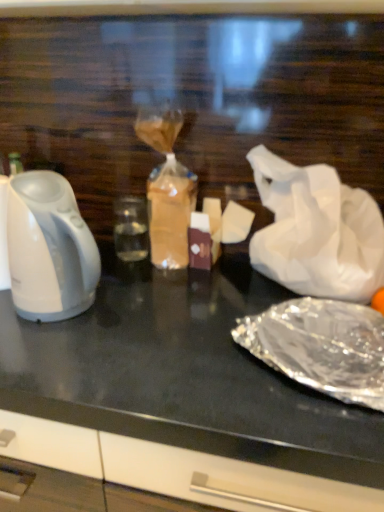
Question: Is white glossy kettle at left wider than shiny metallic foil at lower right?

Choices:
 (A) yes
 (B) no

Answer: (B)

Question: Is white glossy kettle at left taller than shiny metallic foil at lower right?

Choices:
 (A) no
 (B) yes

Answer: (B)

Question: Is white glossy kettle at left looking in the opposite direction of shiny metallic foil at lower right?

Choices:
 (A) no
 (B) yes

Answer: (A)

Question: Considering the relative sizes of white glossy kettle at left and shiny metallic foil at lower right in the image provided, is white glossy kettle at left shorter than shiny metallic foil at lower right?

Choices:
 (A) no
 (B) yes

Answer: (A)

Question: Is white glossy kettle at left not within shiny metallic foil at lower right?

Choices:
 (A) no
 (B) yes

Answer: (B)

Question: Considering the positions of black glossy table at center and white crumpled paper at right in the image, is black glossy table at center bigger or smaller than white crumpled paper at right?

Choices:
 (A) big
 (B) small

Answer: (A)

Question: Is point (230, 397) positioned closer to the camera than point (377, 208)?

Choices:
 (A) closer
 (B) farther

Answer: (A)

Question: Relative to white crumpled paper at right, is black glossy table at center in front or behind?

Choices:
 (A) front
 (B) behind

Answer: (A)

Question: From the image's perspective, relative to white crumpled paper at right, is black glossy table at center above or below?

Choices:
 (A) below
 (B) above

Answer: (A)

Question: From a real-world perspective, is shiny metallic foil at lower right physically located above or below white glossy kettle at left?

Choices:
 (A) above
 (B) below

Answer: (B)

Question: In the image, is shiny metallic foil at lower right on the left side or the right side of white glossy kettle at left?

Choices:
 (A) left
 (B) right

Answer: (B)

Question: Would you say shiny metallic foil at lower right is inside or outside white glossy kettle at left?

Choices:
 (A) outside
 (B) inside

Answer: (A)

Question: Considering the positions of point (309, 323) and point (77, 257), is point (309, 323) closer or farther from the camera than point (77, 257)?

Choices:
 (A) closer
 (B) farther

Answer: (B)

Question: Based on their positions, is black glossy table at center located to the left or right of white glossy kettle at left?

Choices:
 (A) right
 (B) left

Answer: (A)

Question: Would you say black glossy table at center is inside or outside white glossy kettle at left?

Choices:
 (A) outside
 (B) inside

Answer: (A)